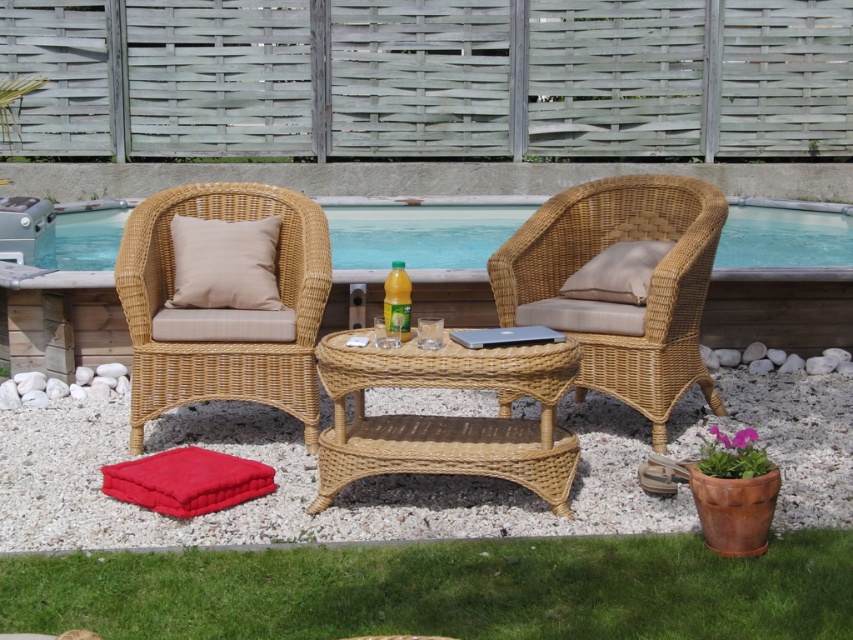
Question: Which point is closer to the camera?

Choices:
 (A) natural wicker armchair at center
 (B) beige fabric cushion at center

Answer: (A)

Question: Can you confirm if transparent blue water at center is positioned above beige fabric cushion at center?

Choices:
 (A) yes
 (B) no

Answer: (A)

Question: Which point is closer to the camera?

Choices:
 (A) (305, 420)
 (B) (473, 202)
 (C) (646, 275)
 (D) (213, 497)

Answer: (D)

Question: Can you confirm if natural wicker armchair at left is bigger than velvet red cushion at lower left?

Choices:
 (A) yes
 (B) no

Answer: (A)

Question: Among these objects, which one is nearest to the camera?

Choices:
 (A) beige fabric cushion at center
 (B) velvet red cushion at lower left
 (C) beige fabric cushion at left
 (D) natural wicker table at center

Answer: (D)

Question: Can you confirm if natural wicker armchair at center is thinner than natural wicker armchair at left?

Choices:
 (A) yes
 (B) no

Answer: (B)